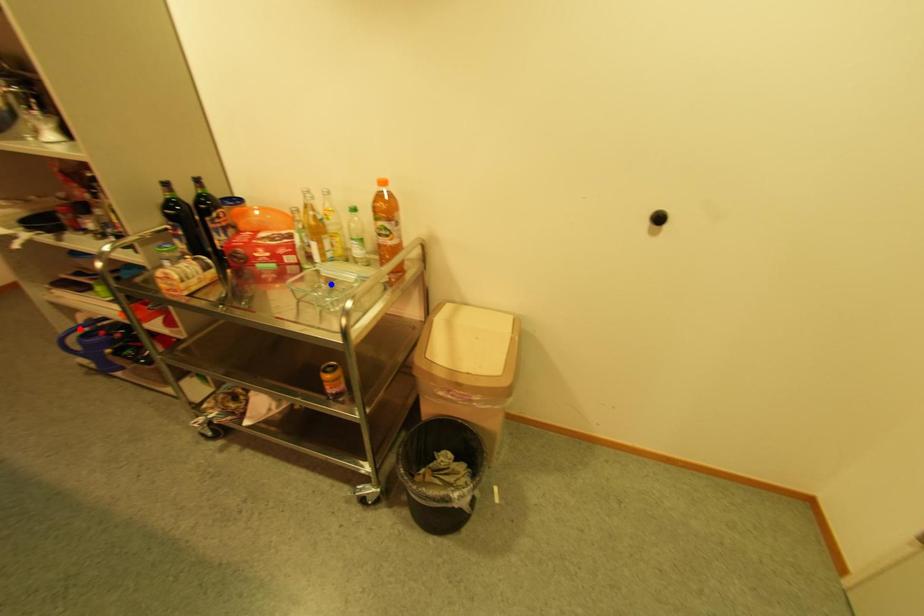
Question: Which of the two points in the image is closer to the camera?

Choices:
 (A) Blue point is closer.
 (B) Red point is closer.

Answer: (A)